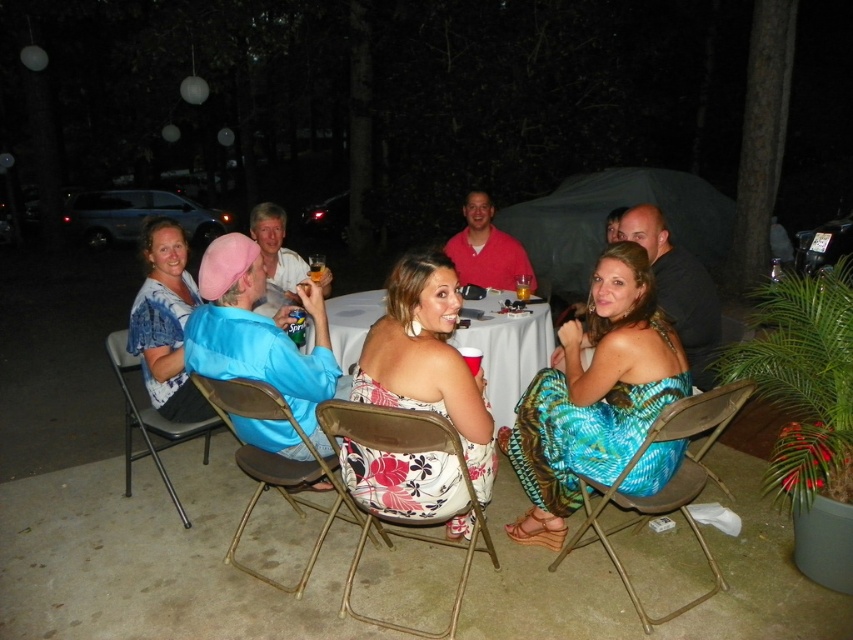
Is floral fabric dress at center closer to the viewer compared to blue fabric bag at left?

Yes, floral fabric dress at center is closer to the viewer.

Between floral fabric dress at center and blue fabric bag at left, which one has more height?

floral fabric dress at center

Is point (370, 449) positioned before point (155, 301)?

Yes.

You are a GUI agent. You are given a task and a screenshot of the screen. Output one action in this format:
    pyautogui.click(x=<x>, y=<y>)
    Task: Click on the floral fabric dress at center
    
    Given the screenshot: What is the action you would take?
    pyautogui.click(x=427, y=358)

The image size is (853, 640). I want to click on floral fabric chair at center, so click(x=403, y=518).

Is point (483, 534) farther from viewer compared to point (163, 474)?

No, it is not.

Between point (370, 440) and point (131, 369), which one is positioned in front?

Positioned in front is point (370, 440).

The width and height of the screenshot is (853, 640). In order to click on floral fabric chair at center in this screenshot , I will do `click(403, 518)`.

In the scene shown: Is metallic gold chair at lower right to the left of metallic blue chair at lower left from the viewer's perspective?

Incorrect, metallic gold chair at lower right is not on the left side of metallic blue chair at lower left.

Between metallic gold chair at lower right and metallic blue chair at lower left, which one is positioned lower?

metallic gold chair at lower right is lower down.

The height and width of the screenshot is (640, 853). In order to click on metallic gold chair at lower right in this screenshot , I will do `click(665, 484)`.